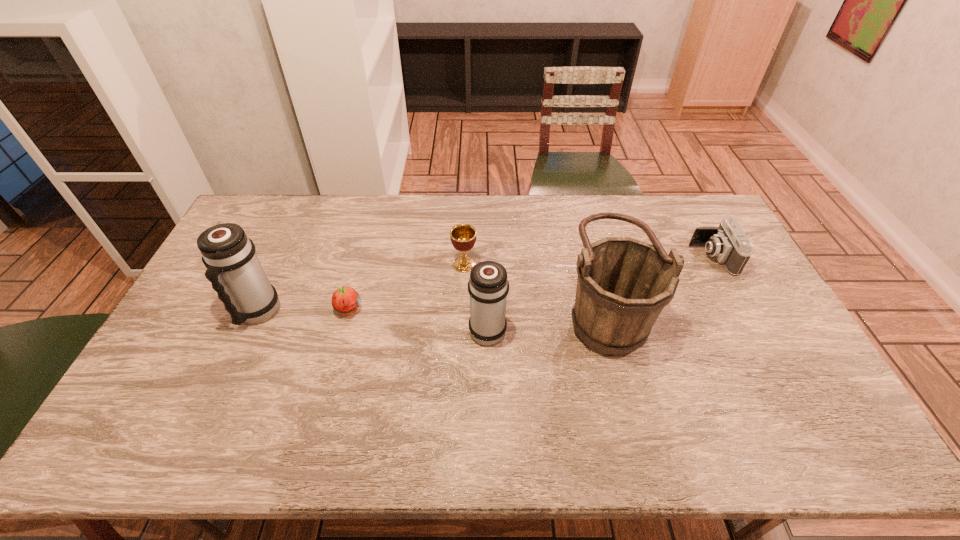
You are a GUI agent. You are given a task and a screenshot of the screen. Output one action in this format:
    pyautogui.click(x=<x>, y=<y>)
    Task: Click on the free space between the second object from left to right and the chalice
    The width and height of the screenshot is (960, 540).
    Given the screenshot: What is the action you would take?
    pyautogui.click(x=406, y=287)

At what (x,y) coordinates should I click in order to perform the action: click on free space between the second object from left to right and the taller thermos bottle. Please return your answer as a coordinate pair (x, y). The width and height of the screenshot is (960, 540). Looking at the image, I should click on (303, 312).

The width and height of the screenshot is (960, 540). What are the coordinates of `vacant area that lies between the second object from left to right and the shorter thermos bottle` in the screenshot? It's located at pos(418,320).

Identify the location of free area in between the chalice and the leftmost object. This screenshot has width=960, height=540. (361, 288).

I want to click on object that is the fourth nearest to the leftmost object, so click(623, 284).

Locate which object is the third closest to the fifth tallest object. Please provide its 2D coordinates. Your answer should be formatted as a tuple, i.e. [(x, y)], where the tuple contains the x and y coordinates of a point satisfying the conditions above.

[(463, 236)]

Find the location of a particular element. The image size is (960, 540). vacant space that satisfies the following two spatial constraints: 1. on the handle side of the bucket; 2. on the side with the handle of the left thermos bottle is located at coordinates (605, 313).

What are the coordinates of `vacant space that satisfies the following two spatial constraints: 1. on the handle side of the second object from right to left; 2. on the side with the handle of the left thermos bottle` in the screenshot? It's located at (605, 313).